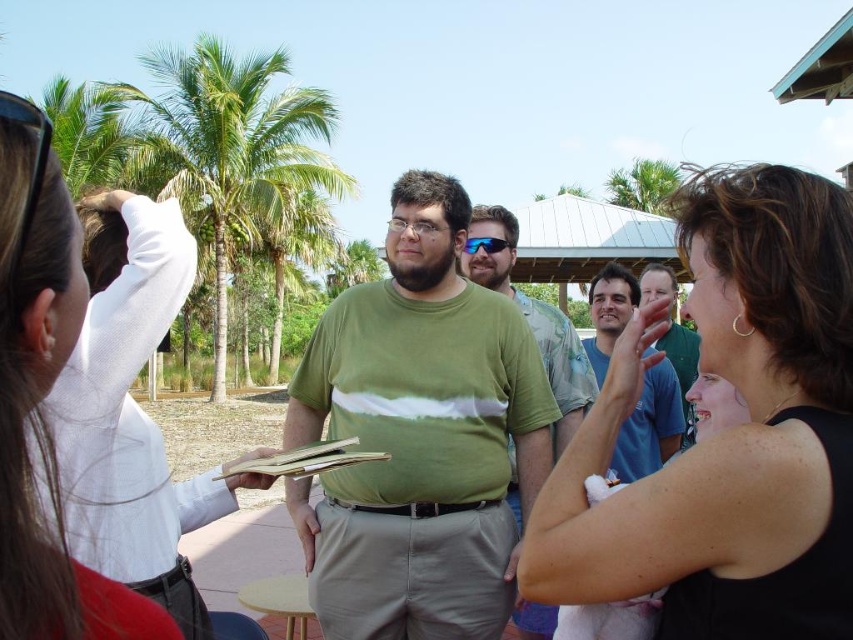
You are a photographer trying to capture a clear shot of the white fabric at left and the green leafy palm tree at upper center. Which object will appear larger in your photo?

The white fabric at left appears larger in the photo because it is closer to the viewer than the green leafy palm tree at upper center.

You are a photographer setting up for a group photo. You notice the white fabric at left and the green leafy palm tree at upper center in your frame. Which object would you need to adjust your camera angle upwards to include fully in the photo?

You would need to adjust your camera angle upwards to include the green leafy palm tree at upper center fully in the photo because it is taller than the white fabric at left.